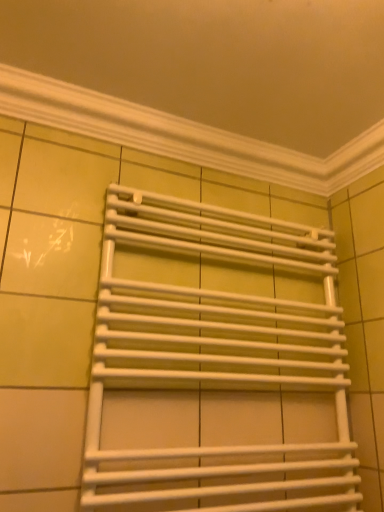
Question: Which is correct: white matte towel rack at center is inside white plastic towel rack at upper center, or outside of it?

Choices:
 (A) inside
 (B) outside

Answer: (B)

Question: Looking at their shapes, would you say white matte towel rack at center is wider or thinner than white plastic towel rack at upper center?

Choices:
 (A) wide
 (B) thin

Answer: (A)

Question: From a real-world perspective, is white matte towel rack at center positioned above or below white plastic towel rack at upper center?

Choices:
 (A) above
 (B) below

Answer: (B)

Question: Considering the positions of white plastic towel rack at upper center and white matte towel rack at center in the image, is white plastic towel rack at upper center bigger or smaller than white matte towel rack at center?

Choices:
 (A) small
 (B) big

Answer: (A)

Question: From the image's perspective, is white plastic towel rack at upper center positioned above or below white matte towel rack at center?

Choices:
 (A) above
 (B) below

Answer: (A)

Question: Based on their positions, is white plastic towel rack at upper center located to the left or right of white matte towel rack at center?

Choices:
 (A) left
 (B) right

Answer: (A)

Question: From a real-world perspective, relative to white matte towel rack at center, is white plastic towel rack at upper center vertically above or below?

Choices:
 (A) above
 (B) below

Answer: (A)